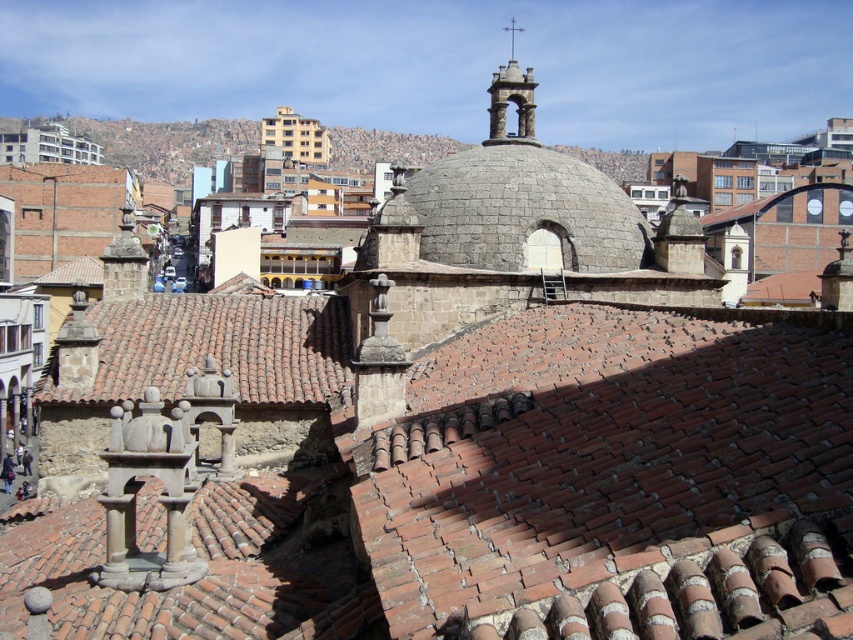
Measure the distance between brown clay tiles at center and gray stone dome at center.

brown clay tiles at center and gray stone dome at center are 16.05 meters apart.

Is point (318, 486) positioned in front of point (573, 256)?

Yes, it is in front of point (573, 256).

What do you see at coordinates (479, 480) in the screenshot?
I see `brown clay tiles at center` at bounding box center [479, 480].

Where is `brown clay tiles at center`? The image size is (853, 640). brown clay tiles at center is located at coordinates (479, 480).

The image size is (853, 640). What do you see at coordinates (212, 348) in the screenshot?
I see `brown tile roof at center` at bounding box center [212, 348].

Which is more to the left, brown tile roof at center or gray stone dome at center?

Positioned to the left is brown tile roof at center.

This screenshot has width=853, height=640. What do you see at coordinates (212, 348) in the screenshot?
I see `brown tile roof at center` at bounding box center [212, 348].

I want to click on brown tile roof at center, so click(x=212, y=348).

Is brown clay tiles at center closer to camera compared to brown tile roof at center?

Yes, it is.

Is brown clay tiles at center behind brown tile roof at center?

That is False.

Is point (804, 612) positioned behind point (334, 378)?

No, (804, 612) is in front of (334, 378).

This screenshot has height=640, width=853. What are the coordinates of `brown clay tiles at center` in the screenshot? It's located at (479, 480).